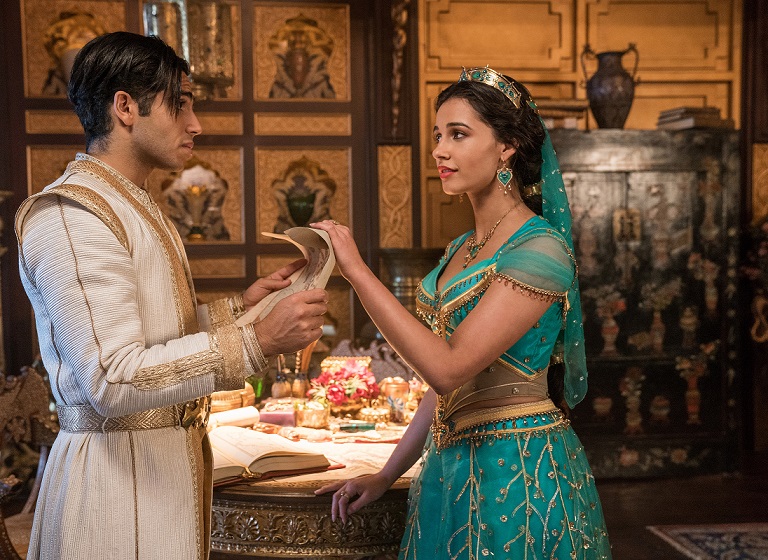
Where is `wooden ornate chest`? The image size is (768, 560). wooden ornate chest is located at coordinates (x=639, y=261).